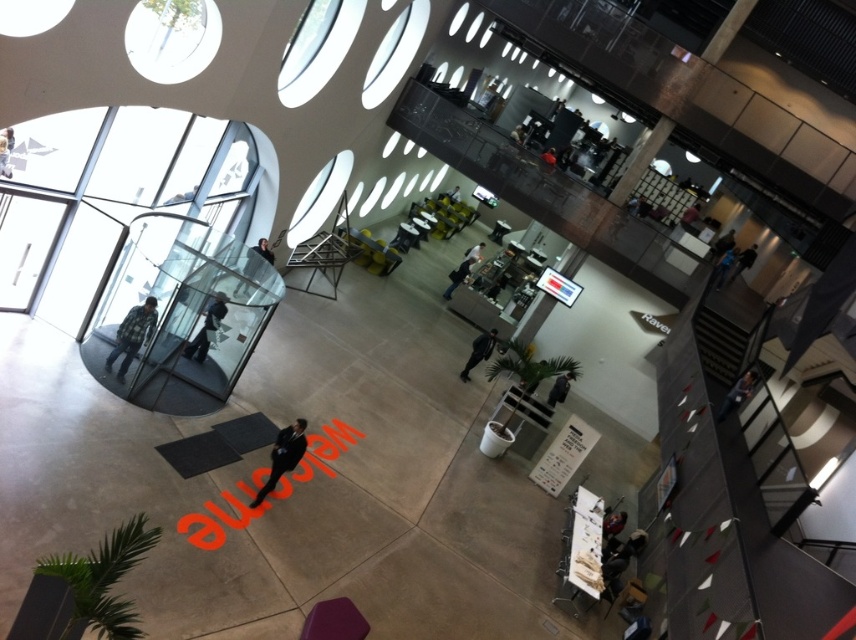
Which is above, dark blue jacket at lower right or matte black jacket at lower right?

dark blue jacket at lower right is higher up.

Is point (746, 376) behind point (610, 515)?

No, it is in front of (610, 515).

Where is `dark blue jacket at lower right`? Image resolution: width=856 pixels, height=640 pixels. dark blue jacket at lower right is located at coordinates (736, 394).

You are a GUI agent. You are given a task and a screenshot of the screen. Output one action in this format:
    pyautogui.click(x=<x>, y=<y>)
    Task: Click on the dark blue jacket at lower right
    This screenshot has width=856, height=640.
    Given the screenshot: What is the action you would take?
    pyautogui.click(x=736, y=394)

Who is lower down, dark blue jacket at lower right or dark blue jeans at center?

Positioned lower is dark blue jacket at lower right.

This screenshot has width=856, height=640. I want to click on dark blue jacket at lower right, so click(x=736, y=394).

The width and height of the screenshot is (856, 640). In order to click on dark blue jacket at lower right in this screenshot , I will do `click(736, 394)`.

What are the coordinates of `dark blue jacket at lower right` in the screenshot? It's located at (736, 394).

Is dark blue jacket at center smaller than dark blue jeans at center?

Correct, dark blue jacket at center occupies less space than dark blue jeans at center.

Is point (223, 304) closer to camera compared to point (476, 349)?

That is True.

Is point (182, 355) closer to viewer compared to point (465, 369)?

Yes, it is.

Identify the location of dark blue jacket at center. (206, 328).